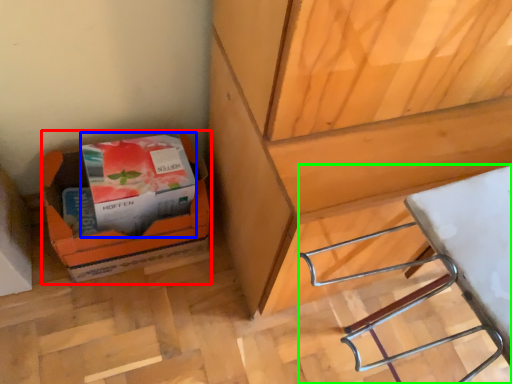
Question: Based on their relative distances, which object is farther from cardboard box (highlighted by a red box)? Choose from paperback book (highlighted by a blue box) and wood (highlighted by a green box).

Choices:
 (A) paperback book
 (B) wood

Answer: (B)